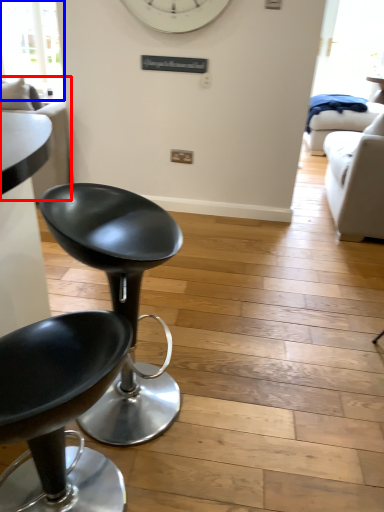
Question: Which point is closer to the camera, couch (highlighted by a red box) or window screen (highlighted by a blue box)?

Choices:
 (A) couch
 (B) window screen

Answer: (A)